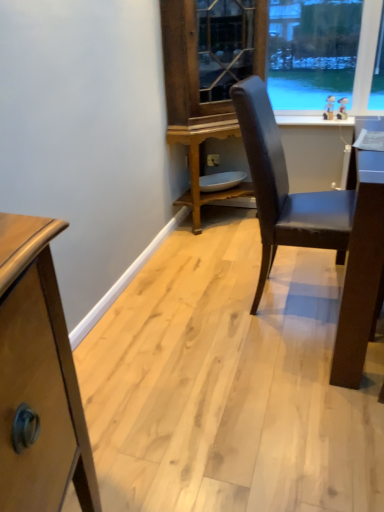
The height and width of the screenshot is (512, 384). What are the coordinates of `free space to the left of matte black chair at center` in the screenshot? It's located at (193, 316).